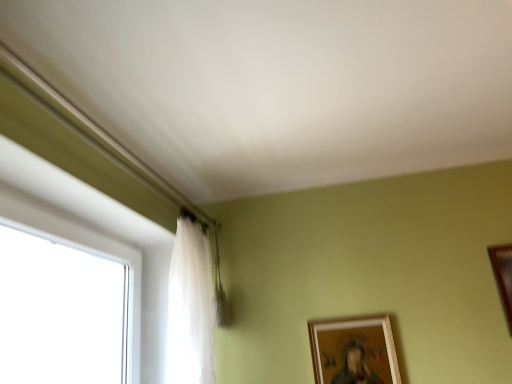
Question: Does point (330, 327) appear closer or farther from the camera than point (508, 279)?

Choices:
 (A) closer
 (B) farther

Answer: (B)

Question: In the image, is wooden picture frame at lower right, acting as the second picture frame starting from the right, positioned in front of or behind wooden picture frame at right, which is counted as the second picture frame, starting from the left?

Choices:
 (A) behind
 (B) front

Answer: (A)

Question: Which is farther from the wooden picture frame at right, which is counted as the 1th picture frame, starting from the right?

Choices:
 (A) translucent fabric curtain at left
 (B) wooden picture frame at lower right, acting as the second picture frame starting from the right

Answer: (A)

Question: Which is farther from the translucent fabric curtain at left?

Choices:
 (A) wooden picture frame at right, which is counted as the 1th picture frame, starting from the right
 (B) wooden picture frame at lower right, arranged as the first picture frame when viewed from the left

Answer: (A)